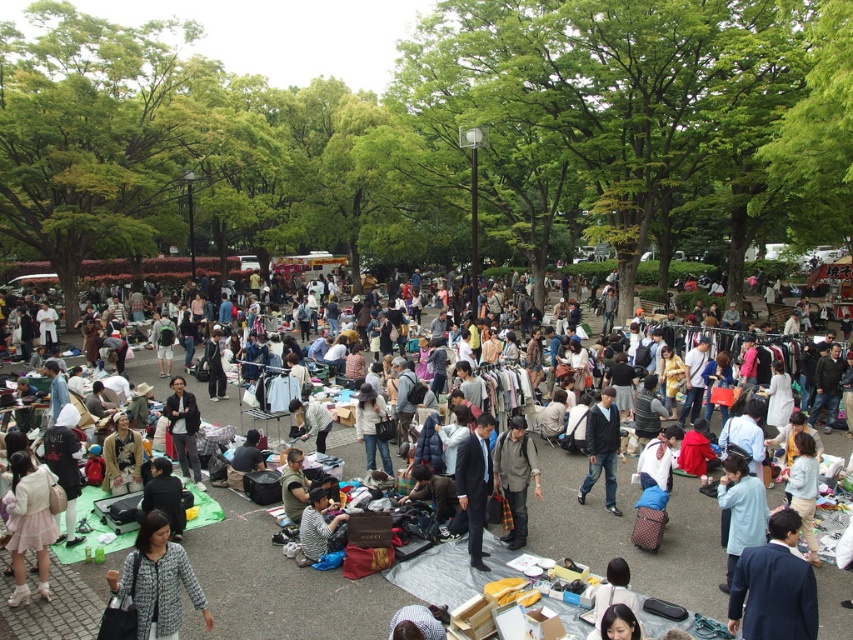
You are standing at the center of the flea market and want to find the dark blue suit at lower right. According to the coordinates provided, in which direction should you move to locate it?

The dark blue suit at lower right is located at coordinates point (775, 586), so you should move towards the lower right direction from the center to find it.

You are standing at the center of the flea market and want to find the light pink fabric skirt at lower left. According to the coordinates provided, in which direction should you move to locate it?

The light pink fabric skirt at lower left is located at coordinates point (28, 522). Since you are at the center, you should move towards the lower left direction to find it.

You are a customer at the flea market and want to pick up both the light blue denim jacket at center and the patterned fabric jacket at lower left. If you can carry both items in one hand, what is the minimum distance you need to walk to collect both jackets?

The minimum distance you need to walk to collect both jackets is 11.40 feet, as that is the distance between the light blue denim jacket at center and the patterned fabric jacket at lower left.